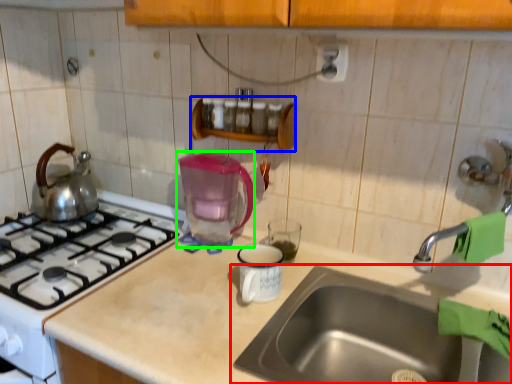
Question: Which object is the closest to the sink (highlighted by a red box)? Choose among these: shelf (highlighted by a blue box) or coffeepot (highlighted by a green box).

Choices:
 (A) shelf
 (B) coffeepot

Answer: (B)